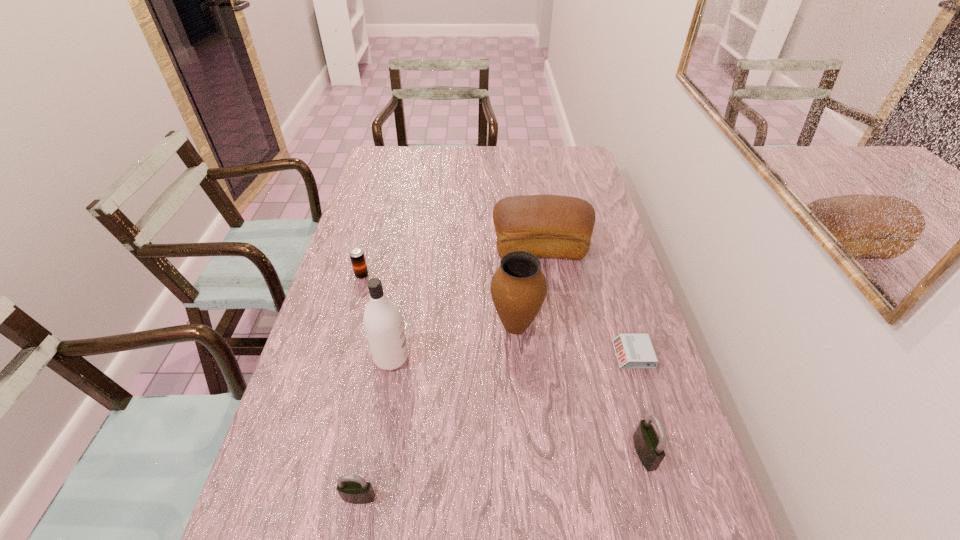
Where is `padlock that is at the right edge`? padlock that is at the right edge is located at coordinates (649, 446).

At what (x,y) coordinates should I click in order to perform the action: click on bread at the right edge. Please return your answer as a coordinate pair (x, y). The width and height of the screenshot is (960, 540). Looking at the image, I should click on (549, 226).

Locate an element on the screen. alarm clock that is at the right edge is located at coordinates (634, 351).

In the image, there is a desktop. Where is `vacant space at the far edge`? This screenshot has width=960, height=540. vacant space at the far edge is located at coordinates (436, 167).

The image size is (960, 540). Find the location of `free space at the near edge of the desktop`. free space at the near edge of the desktop is located at coordinates (442, 497).

I want to click on vacant position at the left edge of the desktop, so click(351, 402).

Find the location of a particular element. vacant area at the right edge is located at coordinates (648, 408).

The height and width of the screenshot is (540, 960). Find the location of `blank space at the near right corner`. blank space at the near right corner is located at coordinates (643, 529).

I want to click on vacant space that's between the leftmost object and the alarm clock, so click(497, 315).

You are a GUI agent. You are given a task and a screenshot of the screen. Output one action in this format:
    pyautogui.click(x=<x>, y=<y>)
    Task: Click on the free area in between the farther padlock and the shampoo
    
    Given the screenshot: What is the action you would take?
    pyautogui.click(x=517, y=406)